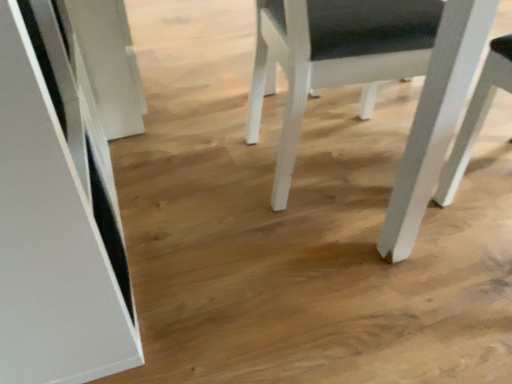
Describe the element at coordinates (334, 56) in the screenshot. This screenshot has height=384, width=512. I see `white matte chair at upper right` at that location.

You are a GUI agent. You are given a task and a screenshot of the screen. Output one action in this format:
    pyautogui.click(x=<x>, y=<y>)
    Task: Click on the white matte chair at upper right
    
    Given the screenshot: What is the action you would take?
    pyautogui.click(x=334, y=56)

You are a GUI agent. You are given a task and a screenshot of the screen. Output one action in this format:
    pyautogui.click(x=<x>, y=<y>)
    Task: Click on the white matte chair at upper right
    
    Given the screenshot: What is the action you would take?
    pyautogui.click(x=334, y=56)